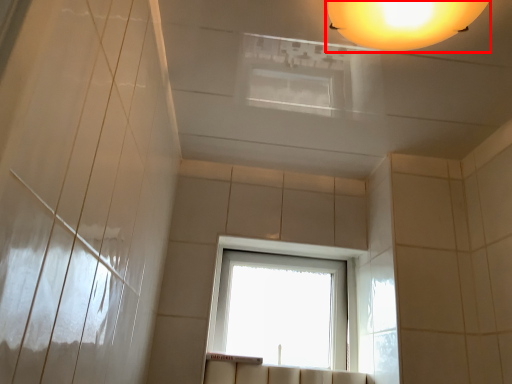
Question: From the image's perspective, where is lamp (annotated by the red box) located relative to window?

Choices:
 (A) above
 (B) below

Answer: (A)